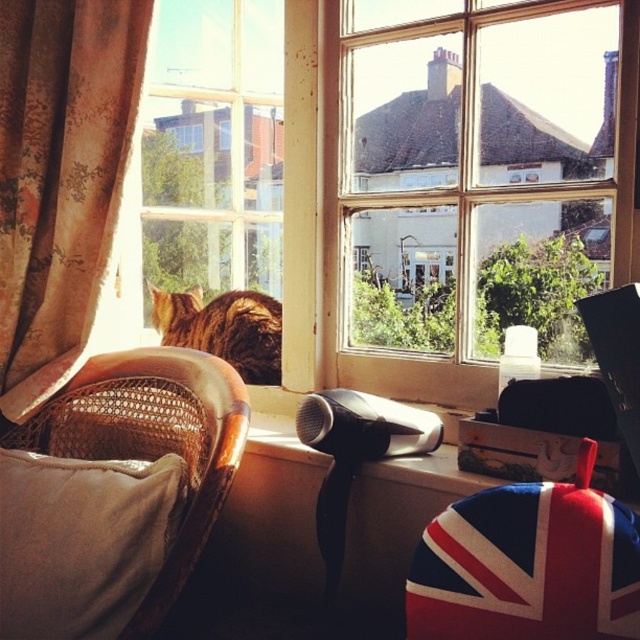
Looking at this image, who is positioned more to the left, wooden frame window at center or floral fabric curtain at left?

Positioned to the left is floral fabric curtain at left.

Can you confirm if wooden frame window at center is wider than floral fabric curtain at left?

Yes, wooden frame window at center is wider than floral fabric curtain at left.

Which is behind, point (496, 237) or point (36, 189)?

Point (36, 189)

This screenshot has width=640, height=640. What are the coordinates of `wooden frame window at center` in the screenshot? It's located at (474, 172).

This screenshot has height=640, width=640. Find the location of `brown woven armchair at left`. brown woven armchair at left is located at coordinates (122, 490).

Can you confirm if brown woven armchair at left is positioned to the left of golden fur cat at left?

Indeed, brown woven armchair at left is positioned on the left side of golden fur cat at left.

Does point (205, 426) lie in front of point (243, 296)?

Yes, it is in front of point (243, 296).

Find the location of a particular element. This screenshot has width=640, height=640. brown woven armchair at left is located at coordinates (122, 490).

Does brown woven armchair at left have a larger size compared to beige fabric pillow at lower left?

Yes, brown woven armchair at left is bigger than beige fabric pillow at lower left.

Where is `brown woven armchair at left`? The image size is (640, 640). brown woven armchair at left is located at coordinates (122, 490).

Locate an element on the screen. The image size is (640, 640). brown woven armchair at left is located at coordinates (122, 490).